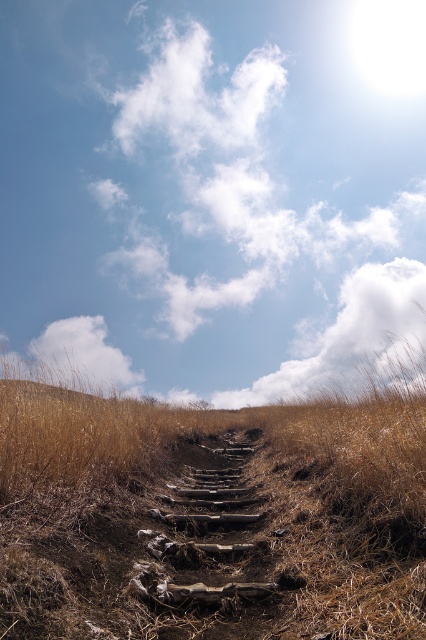
Question: Which object is farther from the camera taking this photo?

Choices:
 (A) blue sky at upper center
 (B) brown dry grass at center

Answer: (A)

Question: Is white fluffy cloud at upper center further to camera compared to white fluffy cloud at upper left?

Choices:
 (A) yes
 (B) no

Answer: (A)

Question: Is blue sky at upper center wider than brown dry grass at center?

Choices:
 (A) yes
 (B) no

Answer: (A)

Question: Which of these objects is positioned closest to the white fluffy cloud at upper center?

Choices:
 (A) brown dry grass at center
 (B) blue sky at upper center
 (C) white fluffy cloud at upper left

Answer: (B)

Question: Is blue sky at upper center to the left of white fluffy cloud at upper center from the viewer's perspective?

Choices:
 (A) no
 (B) yes

Answer: (B)

Question: Which point is closer to the camera?

Choices:
 (A) (51, 637)
 (B) (382, 324)
 (C) (43, 365)
 (D) (206, 248)

Answer: (A)